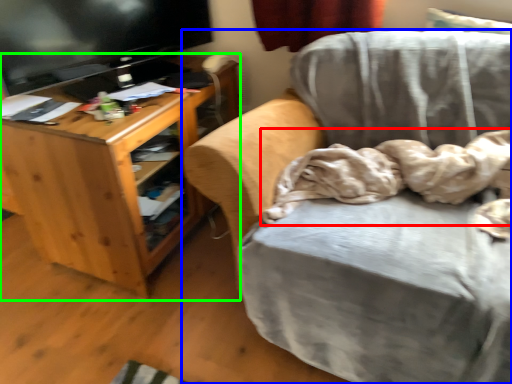
Question: Estimate the real-world distances between objects in this image. Which object is closer to blanket (highlighted by a red box), chair (highlighted by a blue box) or desk (highlighted by a green box)?

Choices:
 (A) chair
 (B) desk

Answer: (A)